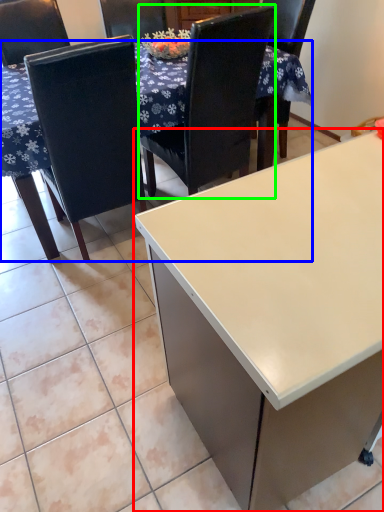
Question: Estimate the real-world distances between objects in this image. Which object is closer to desk (highlighted by a red box), table (highlighted by a blue box) or chair (highlighted by a green box)?

Choices:
 (A) table
 (B) chair

Answer: (B)